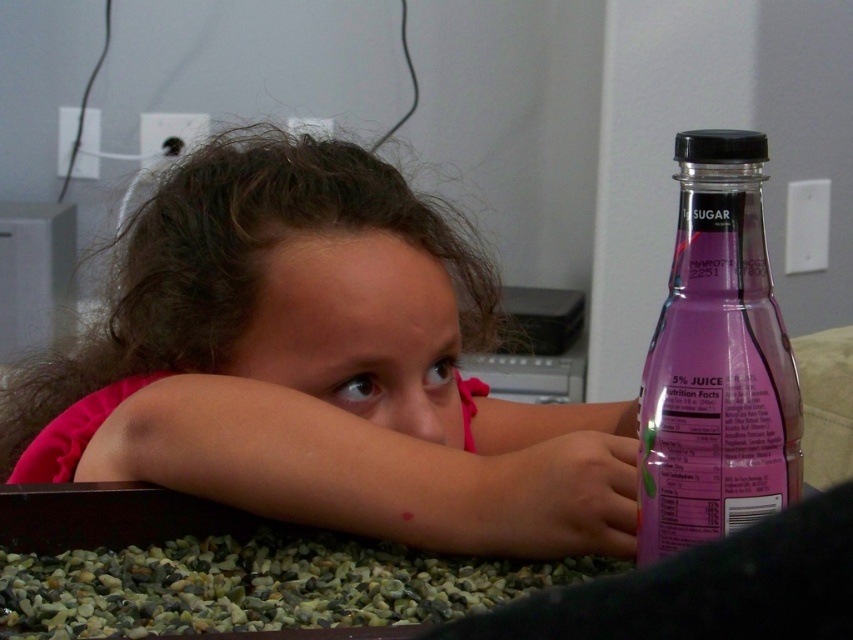
The young girl is holding a translucent plastic hand at lower right. She wants to place the purple glass bottle at right into a cup holder that is 10 cm tall. Can the bottle fit vertically in the cup holder?

The purple glass bottle at right is much taller than the translucent plastic hand at lower right. Since the cup holder is only 10 cm tall, and the bottle is taller than the hand, but we don not know the exact height of the hand, it is uncertain if the bottle will fit. More information is needed.